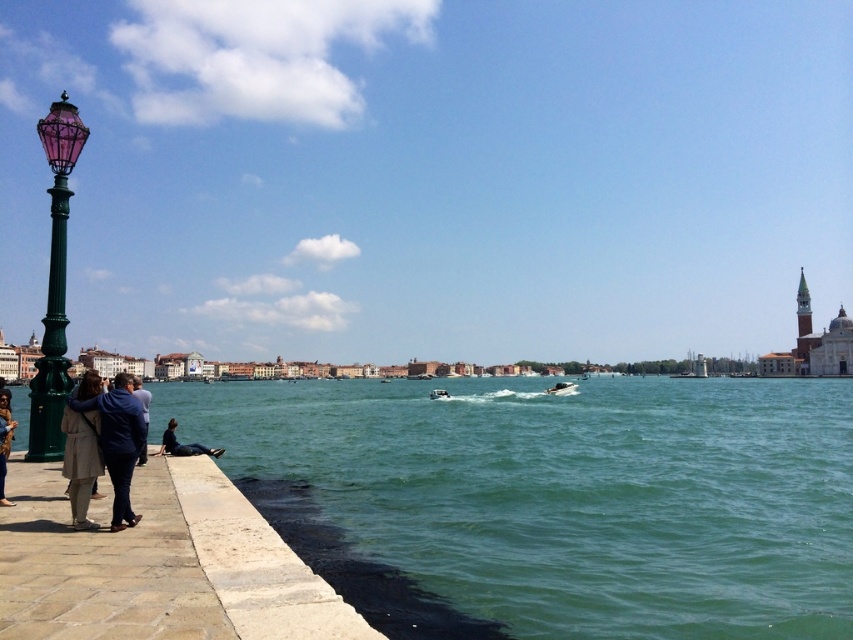
Which is in front, point (318, 472) or point (438, 396)?

Positioned in front is point (318, 472).

Find the location of `green water at lower left`. green water at lower left is located at coordinates (550, 500).

Which is above, dark blue jeans at lower left or metallic silver boat at center?

dark blue jeans at lower left

Is point (178, 449) closer to viewer compared to point (556, 394)?

Yes, it is.

The width and height of the screenshot is (853, 640). Describe the element at coordinates (183, 444) in the screenshot. I see `dark blue jeans at lower left` at that location.

Where is `dark blue jeans at lower left`? dark blue jeans at lower left is located at coordinates (183, 444).

Can you confirm if green water at lower left is thinner than metallic silver boat at center?

Incorrect, green water at lower left's width is not less than metallic silver boat at center's.

Is green water at lower left positioned in front of metallic silver boat at center?

Yes, green water at lower left is closer to the viewer.

Measure the distance between green water at lower left and camera.

green water at lower left and camera are 33.33 meters apart.

Locate an element on the screen. This screenshot has height=640, width=853. green water at lower left is located at coordinates (550, 500).